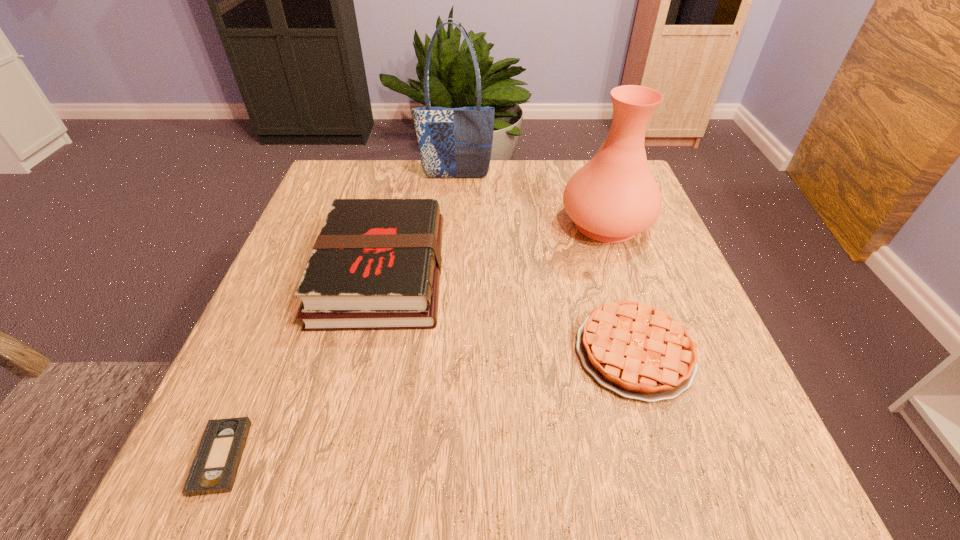
Where is `object at the far right corner`? object at the far right corner is located at coordinates (614, 196).

In the image, there is a desktop. At what (x,y) coordinates should I click in order to perform the action: click on blank space at the far edge. Please return your answer as a coordinate pair (x, y). Looking at the image, I should click on (514, 170).

This screenshot has height=540, width=960. Find the location of `vacant region at the near edge`. vacant region at the near edge is located at coordinates click(649, 490).

This screenshot has width=960, height=540. I want to click on vacant space at the left edge of the desktop, so click(312, 428).

Identify the location of free location at the far left corner. The image size is (960, 540). (383, 163).

Where is `free area in between the vase and the leftmost object`? This screenshot has width=960, height=540. free area in between the vase and the leftmost object is located at coordinates (414, 340).

At what (x,y) coordinates should I click in order to perform the action: click on free space between the shopping bag and the vase. Please return your answer as a coordinate pair (x, y). Looking at the image, I should click on (531, 200).

In order to click on free space between the second tallest object and the second shortest object in this screenshot , I will do `click(620, 287)`.

Identify the location of vacant region between the fourth tallest object and the hardback book. The height and width of the screenshot is (540, 960). (508, 312).

Where is `unoccupied area between the tallest object and the vase`? The width and height of the screenshot is (960, 540). unoccupied area between the tallest object and the vase is located at coordinates (531, 200).